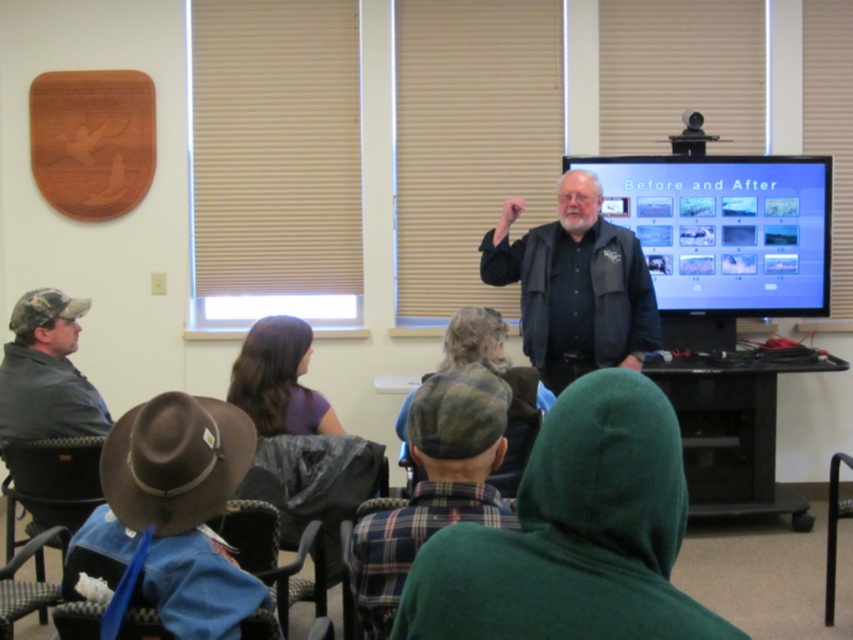
Question: Can you confirm if black leather jacket at center is thinner than brown leather cowboy hat at lower left?

Choices:
 (A) no
 (B) yes

Answer: (A)

Question: Is black leather jacket at center above plaid fabric shirt at center?

Choices:
 (A) yes
 (B) no

Answer: (A)

Question: Which point appears closest to the camera in this image?

Choices:
 (A) (172, 400)
 (B) (39, 428)
 (C) (647, 198)

Answer: (A)

Question: Does black leather jacket at center appear over brown leather cowboy hat at lower left?

Choices:
 (A) yes
 (B) no

Answer: (A)

Question: Which point is farther from the camera taking this photo?

Choices:
 (A) (415, 506)
 (B) (598, 196)
 (C) (775, 180)
 (D) (80, 403)

Answer: (C)

Question: Which of the following is the farthest from the observer?

Choices:
 (A) matte black screen at center
 (B) brown leather cowboy hat at lower left
 (C) plaid fabric shirt at center

Answer: (A)